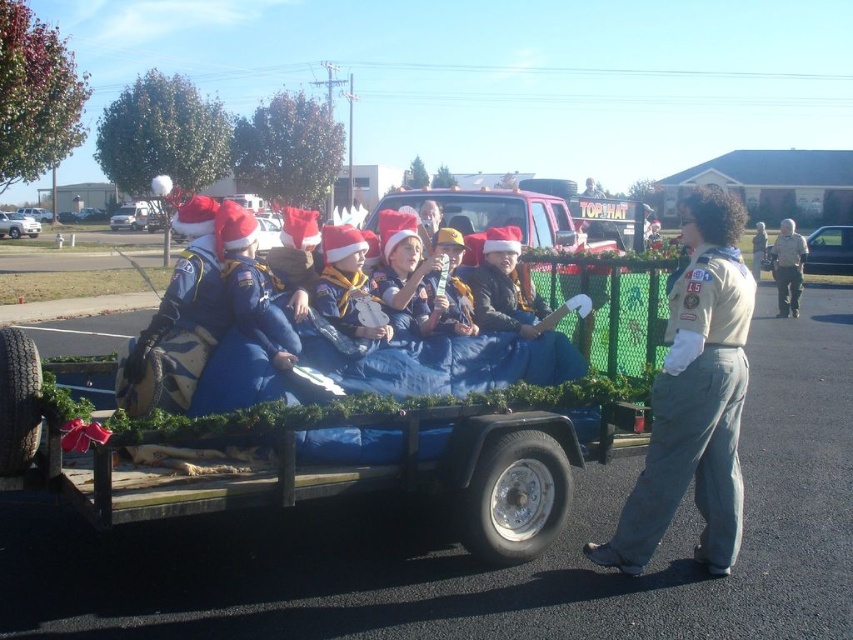
Question: Does tan uniform at center appear over gray uniform at right?

Choices:
 (A) no
 (B) yes

Answer: (A)

Question: Does tan uniform at center have a lesser width compared to gray uniform at right?

Choices:
 (A) yes
 (B) no

Answer: (A)

Question: Can you confirm if tan uniform at center is positioned below gray uniform at right?

Choices:
 (A) no
 (B) yes

Answer: (B)

Question: Which object appears closest to the camera in this image?

Choices:
 (A) gray uniform at right
 (B) tan uniform at center

Answer: (B)

Question: Among these points, which one is farthest from the camera?

Choices:
 (A) (712, 456)
 (B) (787, 237)

Answer: (B)

Question: Which of the following is the closest to the observer?

Choices:
 (A) (793, 266)
 (B) (634, 500)

Answer: (B)